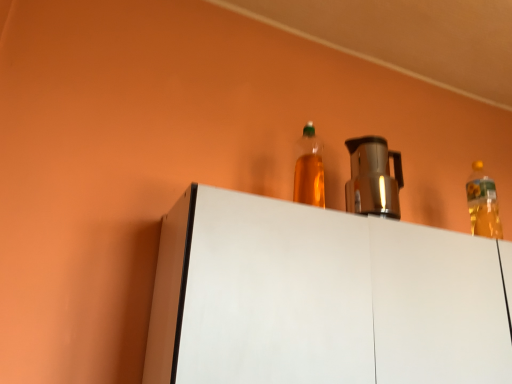
Question: From the image's perspective, is metallic silver coffee pot at center located beneath white matte cabinet at upper center?

Choices:
 (A) yes
 (B) no

Answer: (B)

Question: Are metallic silver coffee pot at center and white matte cabinet at upper center far apart?

Choices:
 (A) yes
 (B) no

Answer: (A)

Question: Is white matte cabinet at upper center at the back of metallic silver coffee pot at center?

Choices:
 (A) no
 (B) yes

Answer: (A)

Question: Is metallic silver coffee pot at center behind white matte cabinet at upper center?

Choices:
 (A) no
 (B) yes

Answer: (B)

Question: Does metallic silver coffee pot at center have a larger size compared to white matte cabinet at upper center?

Choices:
 (A) yes
 (B) no

Answer: (B)

Question: Does metallic silver coffee pot at center have a lesser width compared to white matte cabinet at upper center?

Choices:
 (A) no
 (B) yes

Answer: (B)

Question: Is metallic silver coffee pot at center closer to camera compared to translucent yellow bottle at upper right, the second bottle positioned from the front?

Choices:
 (A) yes
 (B) no

Answer: (A)

Question: From a real-world perspective, is metallic silver coffee pot at center beneath translucent yellow bottle at upper right, the 1th bottle viewed from the back?

Choices:
 (A) no
 (B) yes

Answer: (B)

Question: Considering the relative sizes of metallic silver coffee pot at center and translucent yellow bottle at upper right, the second bottle positioned from the front, in the image provided, is metallic silver coffee pot at center shorter than translucent yellow bottle at upper right, the second bottle positioned from the front,?

Choices:
 (A) no
 (B) yes

Answer: (B)

Question: Can you confirm if metallic silver coffee pot at center is smaller than translucent yellow bottle at upper right, the second bottle positioned from the front?

Choices:
 (A) no
 (B) yes

Answer: (A)

Question: Considering the relative sizes of metallic silver coffee pot at center and translucent yellow bottle at upper right, which is the 2th bottle in left-to-right order, in the image provided, is metallic silver coffee pot at center wider than translucent yellow bottle at upper right, which is the 2th bottle in left-to-right order,?

Choices:
 (A) yes
 (B) no

Answer: (A)

Question: From a real-world perspective, is metallic silver coffee pot at center on translucent yellow bottle at upper right, which is the 2th bottle in left-to-right order?

Choices:
 (A) no
 (B) yes

Answer: (A)

Question: Is white matte cabinet at upper center at the back of translucent plastic bottle at upper center, the 2th bottle viewed from the back?

Choices:
 (A) yes
 (B) no

Answer: (B)